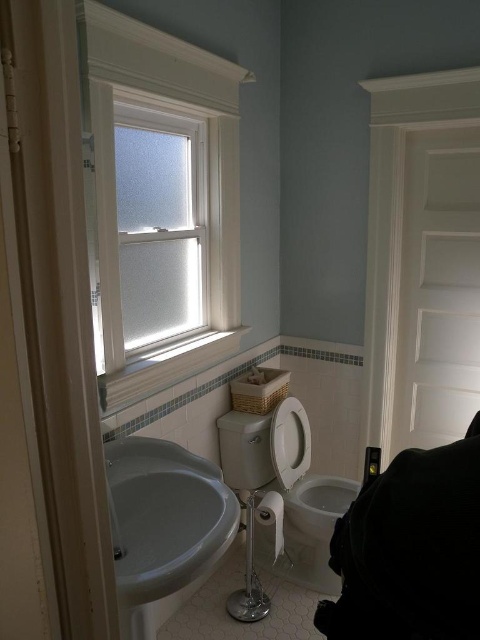
You are trying to determine which object is taller between the white glossy sink at lower left and the white glossy toilet bowl at center. Based on the scene description, which one is taller?

The white glossy toilet bowl at center is taller than the white glossy sink at lower left according to the description.

You are a plumber trying to fix a leak under the sink. You need to access the pipes located behind the white glossy sink at lower left and white glossy toilet bowl at center. Which object should you move first to reach the pipes?

You should move the white glossy sink at lower left first because it is in front of the white glossy toilet bowl at center, so moving the sink will provide access to the pipes behind both objects.